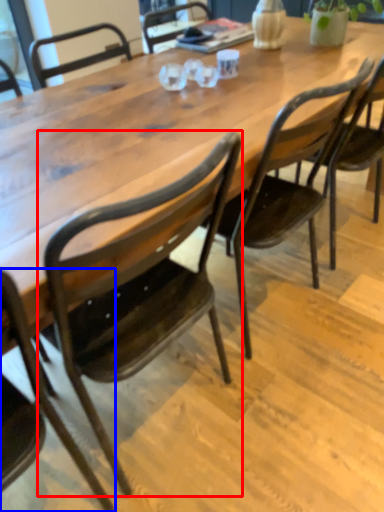
Question: Which object is further to the camera taking this photo, chair (highlighted by a red box) or chair (highlighted by a blue box)?

Choices:
 (A) chair
 (B) chair

Answer: (A)